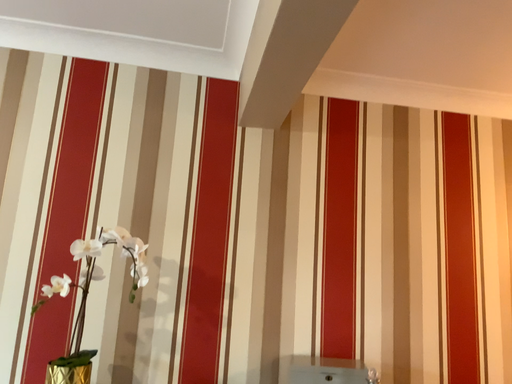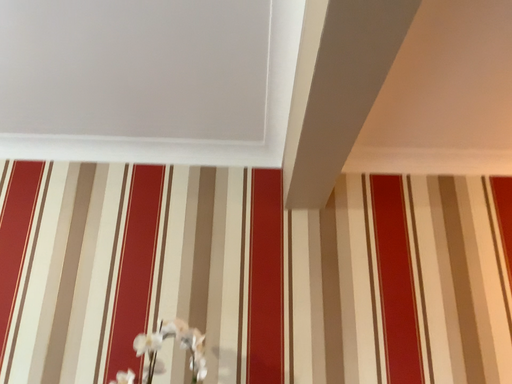
Question: How did the camera likely rotate when shooting the video?

Choices:
 (A) rotated right
 (B) rotated left

Answer: (B)